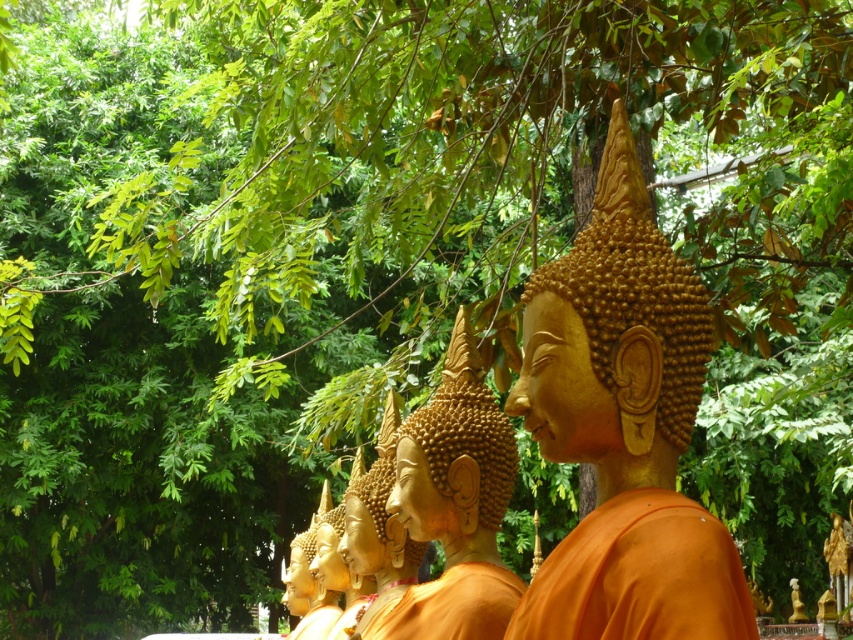
You are standing in front of a row of golden statues under green trees. You want to take a photo of the golden matte statue at center. If your camera can focus on objects up to 5 meters away, will it be able to capture the statue clearly?

The golden matte statue at center and camera are 5.33 meters apart from each other, which exceeds the camera focus range of 5 meters. Therefore, the camera cannot capture the statue clearly.

You are standing in front of a row of golden statues under trees. You see a matte gold monk at center and a golden matte statue at center. Which one is positioned to the right of the other?

The matte gold monk at center is to the right of the golden matte statue at center.

You are standing in front of two statues in a garden. You notice a matte gold monk at center and a golden matte statue at center. Which one is closer to you?

The matte gold monk at center is closer to you because it is in front of the golden matte statue at center.